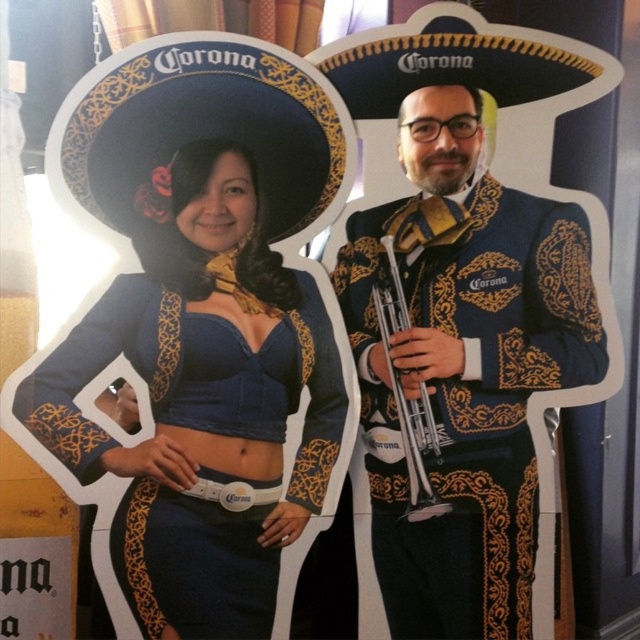
Does matte gold trumpet at center appear on the left side of matte black sombrero at upper left?

In fact, matte gold trumpet at center is to the right of matte black sombrero at upper left.

Find the location of a particular element. This screenshot has height=640, width=640. matte gold trumpet at center is located at coordinates (465, 368).

Does point (456, 138) come behind point (250, 112)?

Yes, it is behind point (250, 112).

Identify the location of matte gold trumpet at center. This screenshot has width=640, height=640. (465, 368).

Can you confirm if matte blue fabric dress at center is thinner than silver metallic trumpet at center?

No.

Who is more distant from viewer, (x=307, y=500) or (x=410, y=509)?

Point (x=410, y=509)

Where is `matte blue fabric dress at center`? matte blue fabric dress at center is located at coordinates (204, 401).

Is matte blue fabric dress at center bigger than matte gold trumpet at center?

Yes.

Is matte blue fabric dress at center in front of matte gold trumpet at center?

Yes, it is in front of matte gold trumpet at center.

At what (x,y) coordinates should I click in order to perform the action: click on matte blue fabric dress at center. Please return your answer as a coordinate pair (x, y). Looking at the image, I should click on (204, 401).

Image resolution: width=640 pixels, height=640 pixels. I want to click on matte blue fabric dress at center, so click(x=204, y=401).